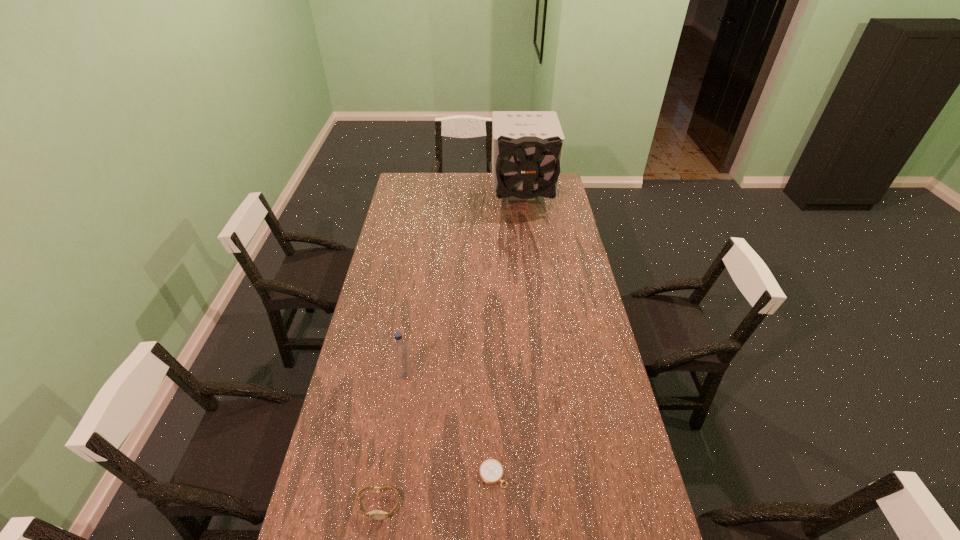
The height and width of the screenshot is (540, 960). Find the location of `blank area located 0.190m on the left of the compass`. blank area located 0.190m on the left of the compass is located at coordinates (414, 474).

The width and height of the screenshot is (960, 540). Find the location of `object situated at the far edge`. object situated at the far edge is located at coordinates coord(527,146).

I want to click on object positioned at the left edge, so click(x=375, y=514).

The image size is (960, 540). Identify the location of object that is at the right edge. coord(527,146).

The width and height of the screenshot is (960, 540). What are the coordinates of `object that is at the far right corner` in the screenshot? It's located at click(527, 146).

In the image, there is a desktop. Where is `blank space at the far edge`? This screenshot has height=540, width=960. blank space at the far edge is located at coordinates (464, 193).

At what (x,y) coordinates should I click in order to perform the action: click on vacant region at the left edge. Please return your answer as a coordinate pair (x, y). Looking at the image, I should click on (404, 212).

The height and width of the screenshot is (540, 960). Find the location of `vacant space at the right edge`. vacant space at the right edge is located at coordinates (588, 300).

Locate an element on the screen. free location at the far left corner is located at coordinates (417, 187).

In order to click on empty space between the water bottle and the fan in this screenshot , I will do `click(464, 286)`.